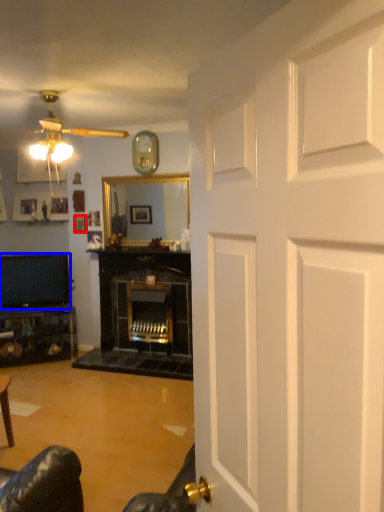
Question: Which point is further to the camera, picture frame (highlighted by a red box) or television (highlighted by a blue box)?

Choices:
 (A) picture frame
 (B) television

Answer: (A)